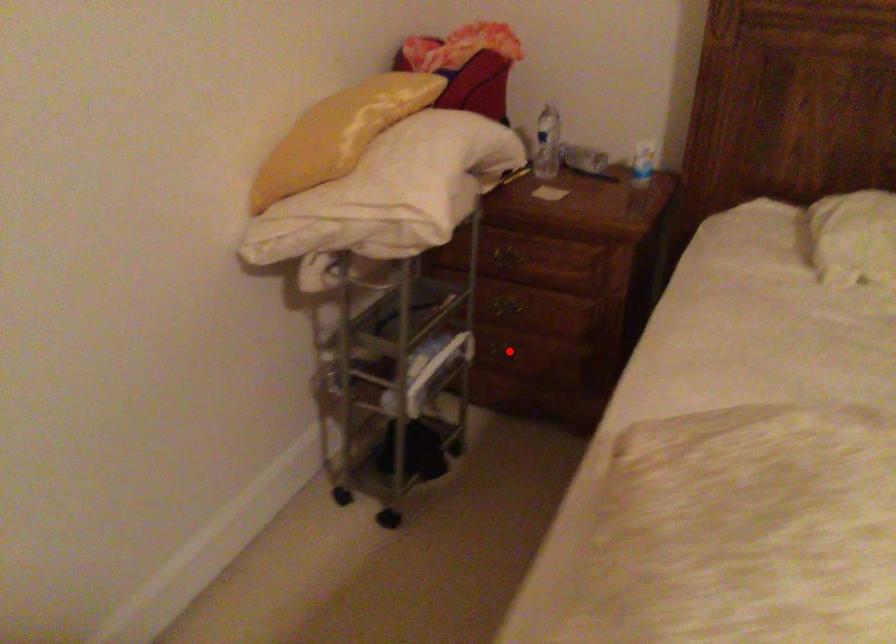
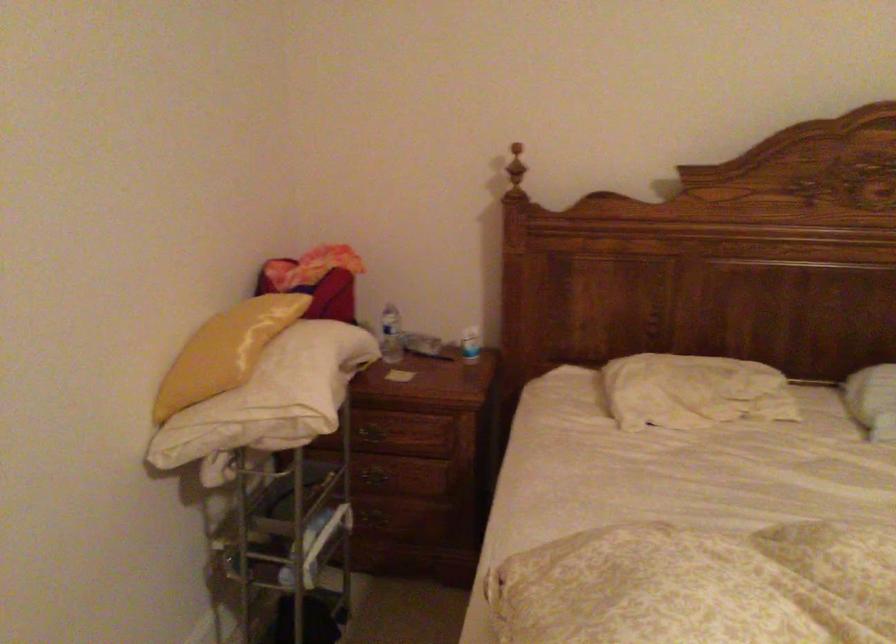
Where in the second image is the point corresponding to the highlighted location from the first image?

(381, 516)